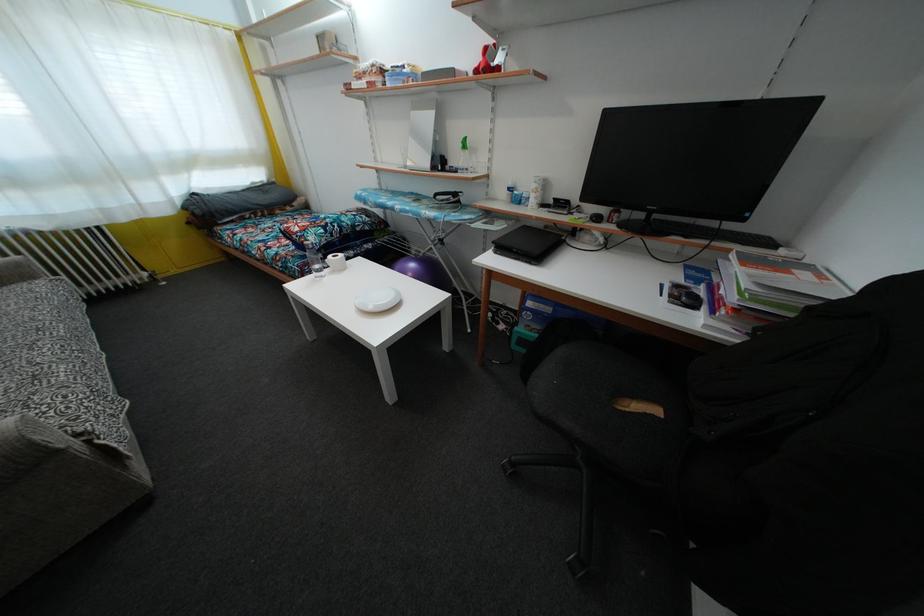
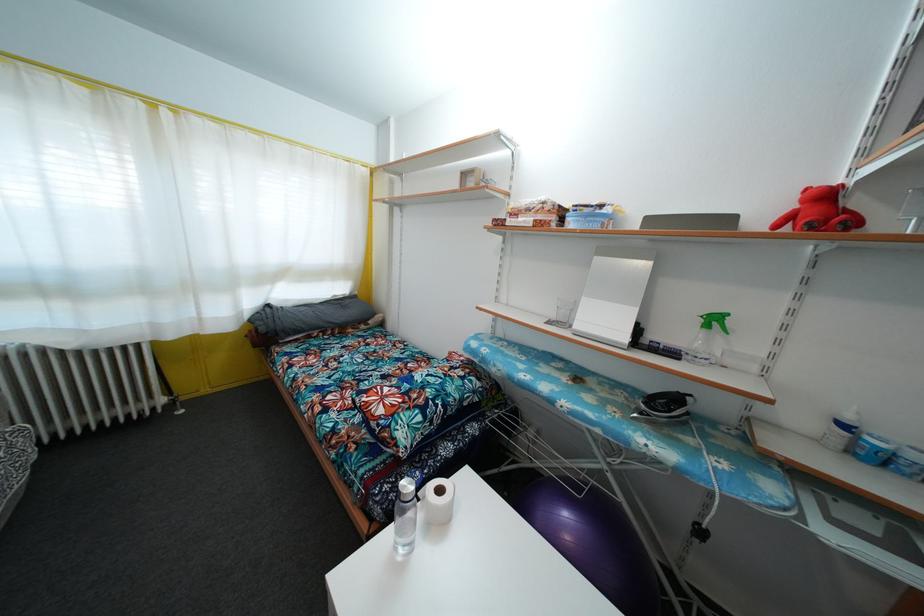
Where in the second image is the point corresponding to point (513, 196) from the first image?

(848, 432)